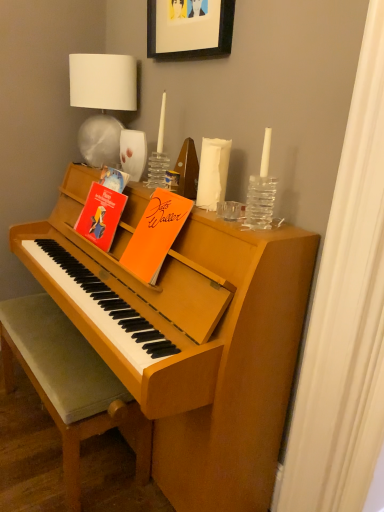
Question: From the image's perspective, is matte paper book at upper left, the 2th paperback book when ordered from right to left, above or below white fabric lampshade at upper left?

Choices:
 (A) below
 (B) above

Answer: (A)

Question: Considering the positions of point (x=87, y=236) and point (x=79, y=87), is point (x=87, y=236) closer or farther from the camera than point (x=79, y=87)?

Choices:
 (A) farther
 (B) closer

Answer: (B)

Question: Which object is the closest to the orange matte paper at upper center, placed as the 2th paperback book when sorted from left to right?

Choices:
 (A) matte paper book at upper left, which appears as the first paperback book when viewed from the left
 (B) white fabric lampshade at upper left
 (C) black matte picture frame at upper center
 (D) velvet grey cushioned bench at lower left

Answer: (A)

Question: Which of these objects is positioned closest to the orange matte paper at upper center, the first paperback book positioned from the right?

Choices:
 (A) matte paper book at upper left, the 2th paperback book when ordered from right to left
 (B) velvet grey cushioned bench at lower left
 (C) white fabric lampshade at upper left
 (D) black matte picture frame at upper center

Answer: (A)